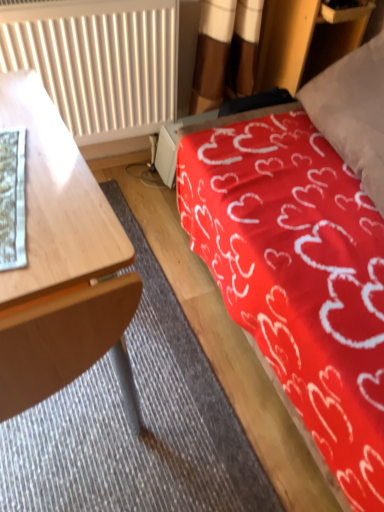
Question: From the image's perspective, is red fabric bed at upper right above wooden desk at left?

Choices:
 (A) yes
 (B) no

Answer: (A)

Question: Considering the relative sizes of red fabric bed at upper right and wooden desk at left in the image provided, is red fabric bed at upper right wider than wooden desk at left?

Choices:
 (A) no
 (B) yes

Answer: (B)

Question: Does red fabric bed at upper right have a lesser height compared to wooden desk at left?

Choices:
 (A) yes
 (B) no

Answer: (A)

Question: Is red fabric bed at upper right looking in the opposite direction of wooden desk at left?

Choices:
 (A) yes
 (B) no

Answer: (B)

Question: Does red fabric bed at upper right have a larger size compared to wooden desk at left?

Choices:
 (A) yes
 (B) no

Answer: (A)

Question: Considering the relative sizes of red fabric bed at upper right and wooden desk at left in the image provided, is red fabric bed at upper right taller than wooden desk at left?

Choices:
 (A) no
 (B) yes

Answer: (A)

Question: Would you say wooden desk at left is outside white textured radiator at upper left?

Choices:
 (A) no
 (B) yes

Answer: (B)

Question: Can you confirm if wooden desk at left is taller than white textured radiator at upper left?

Choices:
 (A) yes
 (B) no

Answer: (A)

Question: Is wooden desk at left far from white textured radiator at upper left?

Choices:
 (A) no
 (B) yes

Answer: (A)

Question: From the image's perspective, would you say wooden desk at left is shown under white textured radiator at upper left?

Choices:
 (A) yes
 (B) no

Answer: (A)

Question: Is wooden desk at left bigger than white textured radiator at upper left?

Choices:
 (A) no
 (B) yes

Answer: (B)

Question: Considering the relative positions of wooden desk at left and white textured radiator at upper left in the image provided, is wooden desk at left to the right of white textured radiator at upper left from the viewer's perspective?

Choices:
 (A) yes
 (B) no

Answer: (B)

Question: Does white paper at left contain wooden desk at left?

Choices:
 (A) yes
 (B) no

Answer: (B)